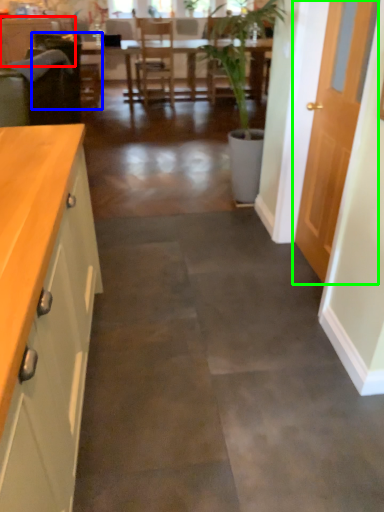
Question: Based on their relative distances, which object is nearer to cabinetry (highlighted by a red box)? Choose from armchair (highlighted by a blue box) and door (highlighted by a green box).

Choices:
 (A) armchair
 (B) door

Answer: (A)